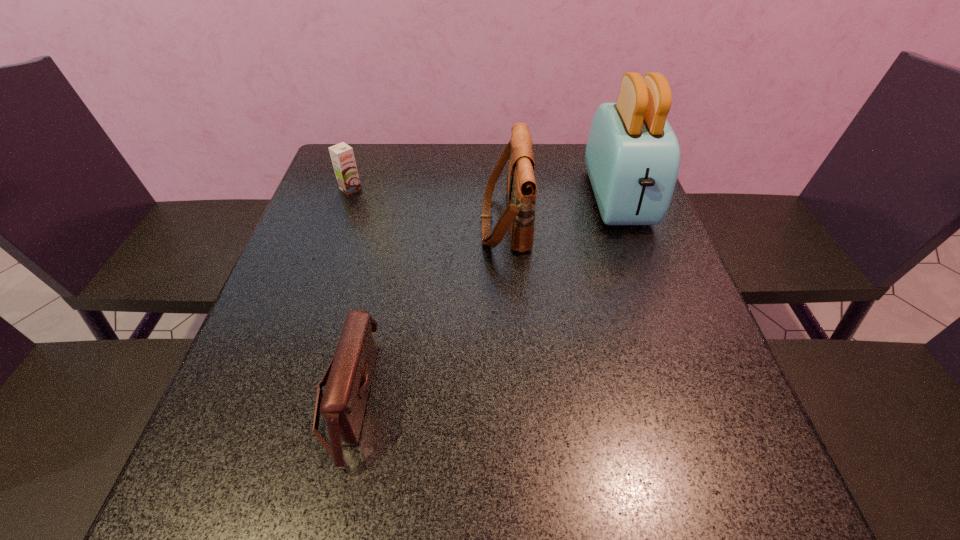
Find the location of a particular element. This screenshot has height=540, width=960. free area in between the shorter shoulder bag and the rightmost object is located at coordinates (483, 298).

Locate an element on the screen. vacant space in between the rightmost object and the second tallest object is located at coordinates (562, 210).

The height and width of the screenshot is (540, 960). In order to click on free space that is in between the left shoulder bag and the right shoulder bag in this screenshot , I will do `click(426, 308)`.

Identify the location of vacant area between the second tallest object and the chocolate milk. [x=428, y=205].

Choose which object is the nearest neighbor to the second tallest object. Please provide its 2D coordinates. Your answer should be formatted as a tuple, i.e. [(x, y)], where the tuple contains the x and y coordinates of a point satisfying the conditions above.

[(632, 157)]

This screenshot has width=960, height=540. Find the location of `the closest object to the leftmost object`. the closest object to the leftmost object is located at coordinates (521, 188).

At what (x,y) coordinates should I click in order to perform the action: click on free space that satisfies the following two spatial constraints: 1. on the side of the rightmost object with the lever; 2. on the front flap of the nearer shoulder bag. Please return your answer as a coordinate pair (x, y). Image resolution: width=960 pixels, height=540 pixels. Looking at the image, I should click on (690, 396).

Where is `free space that satisfies the following two spatial constraints: 1. on the side of the tallest object with the lever; 2. on the front flap of the nearer shoulder bag`? free space that satisfies the following two spatial constraints: 1. on the side of the tallest object with the lever; 2. on the front flap of the nearer shoulder bag is located at coordinates (690, 396).

Where is `vacant position in the image that satisfies the following two spatial constraints: 1. on the side of the tallest object with the lever; 2. on the front flap of the third object from right to left`? vacant position in the image that satisfies the following two spatial constraints: 1. on the side of the tallest object with the lever; 2. on the front flap of the third object from right to left is located at coordinates (690, 396).